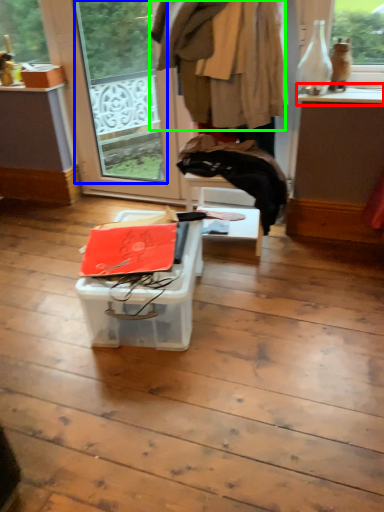
Question: Based on their relative distances, which object is farther from window sill (highlighted by a red box)? Choose from window screen (highlighted by a blue box) and clothing (highlighted by a green box).

Choices:
 (A) window screen
 (B) clothing

Answer: (A)